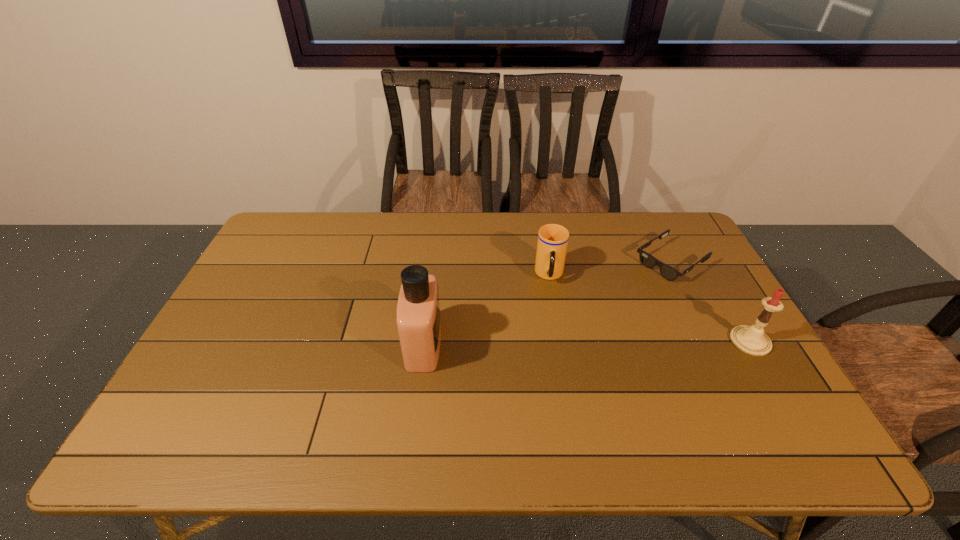
Identify the location of free space located on the temples of the sunglasses. (638, 283).

Where is `free space located 0.400m on the side of the cup with the handle`? The image size is (960, 540). free space located 0.400m on the side of the cup with the handle is located at coordinates (552, 405).

Locate an element on the screen. free space located on the side of the cup with the handle is located at coordinates (551, 301).

This screenshot has height=540, width=960. In order to click on vacant area located on the side of the cup with the handle in this screenshot , I will do `click(552, 401)`.

This screenshot has width=960, height=540. What are the coordinates of `object that is positioned at the far edge` in the screenshot? It's located at (669, 273).

This screenshot has width=960, height=540. What are the coordinates of `candle that is at the right edge` in the screenshot? It's located at (752, 340).

This screenshot has height=540, width=960. What are the coordinates of `sunglasses located at the right edge` in the screenshot? It's located at (669, 273).

What are the coordinates of `object that is at the far right corner` in the screenshot? It's located at (669, 273).

This screenshot has height=540, width=960. Find the location of `vacant space at the far edge`. vacant space at the far edge is located at coordinates (444, 212).

You are a GUI agent. You are given a task and a screenshot of the screen. Output one action in this format:
    pyautogui.click(x=<x>, y=<y>)
    Task: Click on the vacant area at the near edge
    
    Given the screenshot: What is the action you would take?
    pyautogui.click(x=480, y=392)